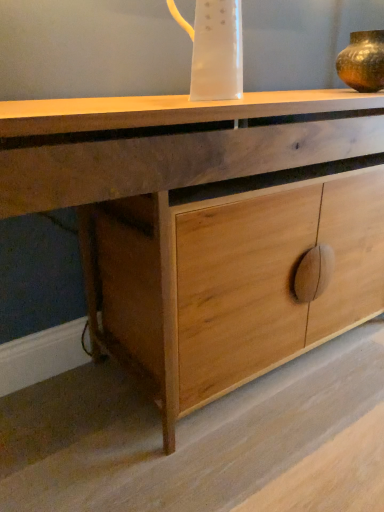
In order to face natural wood cabinet at center, should I rotate leftwards or rightwards?

Turn right approximately 11.369 degrees to face it.

The height and width of the screenshot is (512, 384). Find the location of `natural wood cabinet at center`. natural wood cabinet at center is located at coordinates (172, 172).

In order to face gold metallic vase at upper right, should I rotate leftwards or rightwards?

Turn right approximately 22.987 degrees to face it.

Identify the location of transparent plastic jug at upper center. The image size is (384, 512). (215, 49).

The height and width of the screenshot is (512, 384). What do you see at coordinates (215, 49) in the screenshot?
I see `transparent plastic jug at upper center` at bounding box center [215, 49].

Image resolution: width=384 pixels, height=512 pixels. I want to click on natural wood cabinet at center, so click(x=172, y=172).

Between gold metallic vase at upper right and natural wood cabinet at center, which one is positioned behind?

gold metallic vase at upper right.

Between point (355, 56) and point (6, 156), which one is positioned behind?

The point (355, 56) is behind.

Would you consider gold metallic vase at upper right to be distant from natural wood cabinet at center?

No, gold metallic vase at upper right is not far away from natural wood cabinet at center.

Are transparent plastic jug at upper center and gold metallic vase at upper right beside each other?

transparent plastic jug at upper center and gold metallic vase at upper right are not in contact.

From the picture: From the image's perspective, would you say transparent plastic jug at upper center is positioned over gold metallic vase at upper right?

No, from the image's perspective, transparent plastic jug at upper center is not above gold metallic vase at upper right.

Between transparent plastic jug at upper center and gold metallic vase at upper right, which one appears on the right side from the viewer's perspective?

gold metallic vase at upper right is more to the right.

Which object is thinner, natural wood cabinet at center or transparent plastic jug at upper center?

transparent plastic jug at upper center.

Is natural wood cabinet at center to the right of transparent plastic jug at upper center from the viewer's perspective?

Correct, you'll find natural wood cabinet at center to the right of transparent plastic jug at upper center.

Based on the photo, from a real-world perspective, between natural wood cabinet at center and transparent plastic jug at upper center, who is vertically higher?

From a 3D spatial view, transparent plastic jug at upper center is above.

What's the angular difference between natural wood cabinet at center and transparent plastic jug at upper center's facing directions?

The angle between the facing direction of natural wood cabinet at center and the facing direction of transparent plastic jug at upper center is 2.11 degrees.

Is natural wood cabinet at center completely or partially outside of gold metallic vase at upper right?

Indeed, natural wood cabinet at center is completely outside gold metallic vase at upper right.

Is natural wood cabinet at center aimed at gold metallic vase at upper right?

No, natural wood cabinet at center is not aimed at gold metallic vase at upper right.

Can you tell me how much natural wood cabinet at center and gold metallic vase at upper right differ in facing direction?

2.6 degrees.

From the image's perspective, between transparent plastic jug at upper center and natural wood cabinet at center, who is located below?

From the image's view, natural wood cabinet at center is below.

Is natural wood cabinet at center completely or partially inside transparent plastic jug at upper center?

No, natural wood cabinet at center is not a part of transparent plastic jug at upper center.

Based on the photo, who is taller, transparent plastic jug at upper center or natural wood cabinet at center?

Standing taller between the two is natural wood cabinet at center.

Considering the sizes of objects gold metallic vase at upper right and transparent plastic jug at upper center in the image provided, who is bigger, gold metallic vase at upper right or transparent plastic jug at upper center?

gold metallic vase at upper right is bigger.

Considering the positions of objects gold metallic vase at upper right and transparent plastic jug at upper center in the image provided, who is behind, gold metallic vase at upper right or transparent plastic jug at upper center?

gold metallic vase at upper right is more distant.

Can you see gold metallic vase at upper right touching transparent plastic jug at upper center?

No, gold metallic vase at upper right is not making contact with transparent plastic jug at upper center.

Does point (379, 44) appear closer or farther from the camera than point (219, 1)?

Point (379, 44) is positioned farther from the camera compared to point (219, 1).

The height and width of the screenshot is (512, 384). I want to click on chest of drawers that appears on the left of gold metallic vase at upper right, so click(172, 172).

You are a GUI agent. You are given a task and a screenshot of the screen. Output one action in this format:
    pyautogui.click(x=<x>, y=<y>)
    Task: Click on the candle holder below the transparent plastic jug at upper center (from a real-world perspective)
    The image size is (384, 512).
    Given the screenshot: What is the action you would take?
    pyautogui.click(x=363, y=61)

When comparing their distances from natural wood cabinet at center, does gold metallic vase at upper right or transparent plastic jug at upper center seem further?

gold metallic vase at upper right.

Consider the image. Looking at the image, which one is located closer to gold metallic vase at upper right, transparent plastic jug at upper center or natural wood cabinet at center?

transparent plastic jug at upper center is positioned closer to the anchor gold metallic vase at upper right.

Based on the photo, considering their positions, is transparent plastic jug at upper center positioned further to natural wood cabinet at center than gold metallic vase at upper right?

gold metallic vase at upper right is further to natural wood cabinet at center.

From the image, which object appears to be farther from transparent plastic jug at upper center, gold metallic vase at upper right or natural wood cabinet at center?

gold metallic vase at upper right lies further to transparent plastic jug at upper center than the other object.

From the image, which object appears to be farther from transparent plastic jug at upper center, natural wood cabinet at center or gold metallic vase at upper right?

Based on the image, gold metallic vase at upper right appears to be further to transparent plastic jug at upper center.

Based on their spatial positions, is natural wood cabinet at center or transparent plastic jug at upper center further from gold metallic vase at upper right?

natural wood cabinet at center.

Where is `jug between natural wood cabinet at center and gold metallic vase at upper right in the front-back direction`? jug between natural wood cabinet at center and gold metallic vase at upper right in the front-back direction is located at coordinates (215, 49).